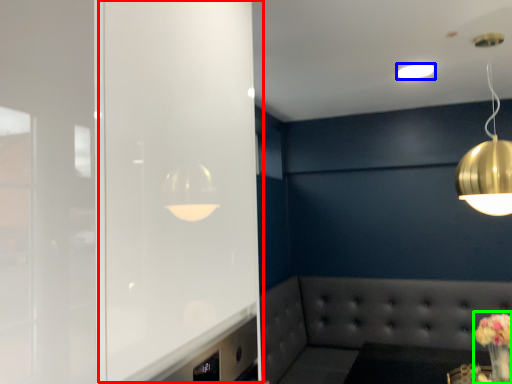
Question: Which object is positioned closest to glass door (highlighted by a red box)? Select from lamp (highlighted by a blue box) and floral arrangement (highlighted by a green box).

Choices:
 (A) lamp
 (B) floral arrangement

Answer: (B)